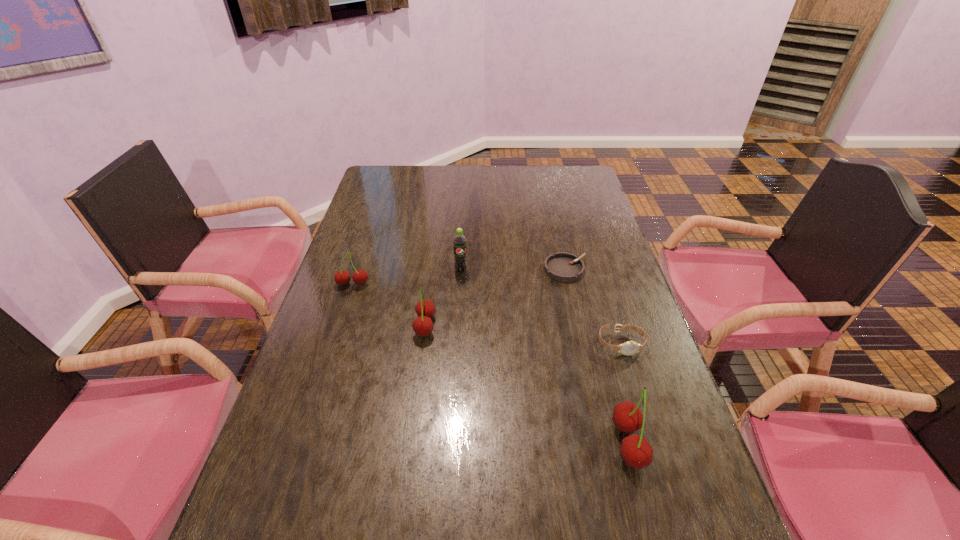
Please point a spot to place another cherry for symmetrical spacing. Please provide its 2D coordinates. Your answer should be formatted as a tuple, i.e. [(x, y)], where the tuple contains the x and y coordinates of a point satisfying the conditions above.

[(515, 377)]